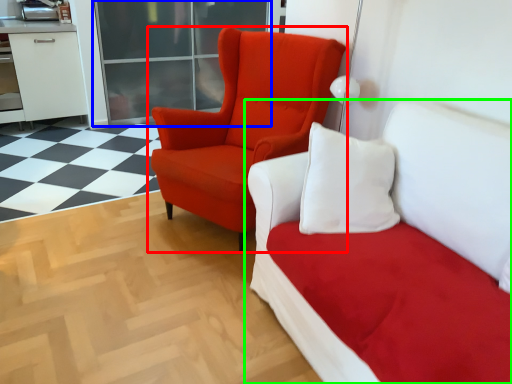
Question: Which object is the farthest from chair (highlighted by a red box)? Choose among these: glass door (highlighted by a blue box) or studio couch (highlighted by a green box).

Choices:
 (A) glass door
 (B) studio couch

Answer: (A)